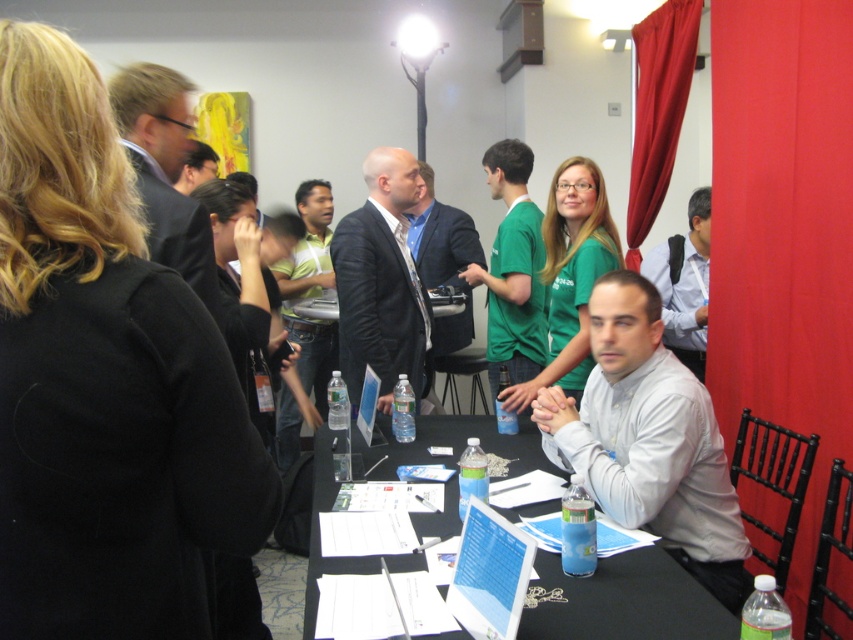
You are standing at the entrance of the room and want to walk towards the table. Which point, point (445, 529) or point (670, 65), is closer to you as you approach the table?

Point (445, 529) is closer to the camera than point (670, 65), so it is closer to you as you approach the table.